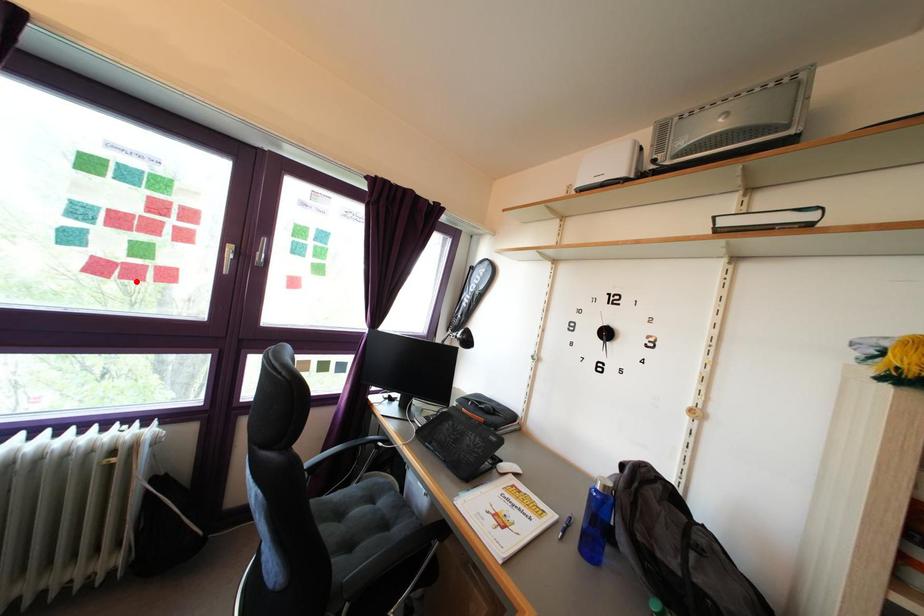
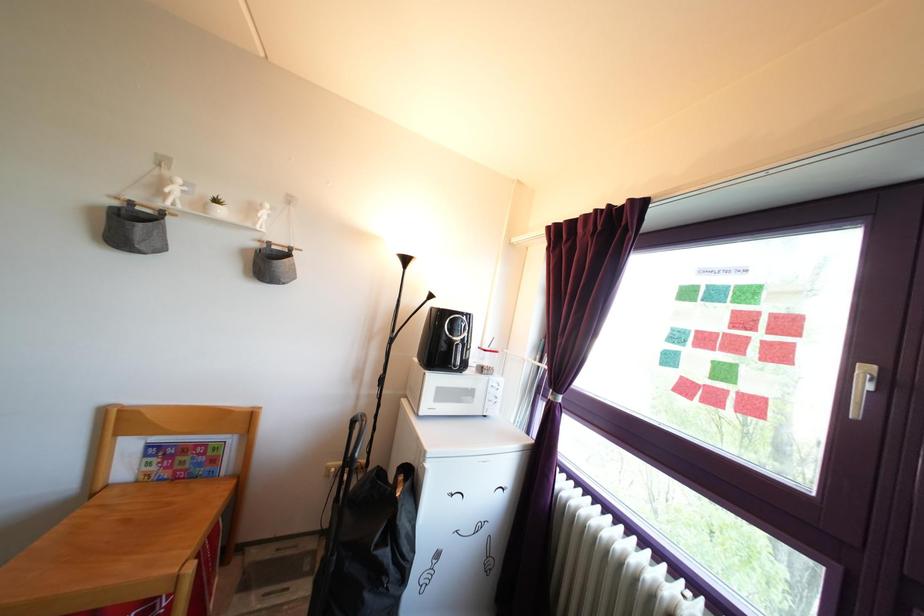
Where in the second image is the point corresponding to the highlighted location from the first image?

(715, 407)